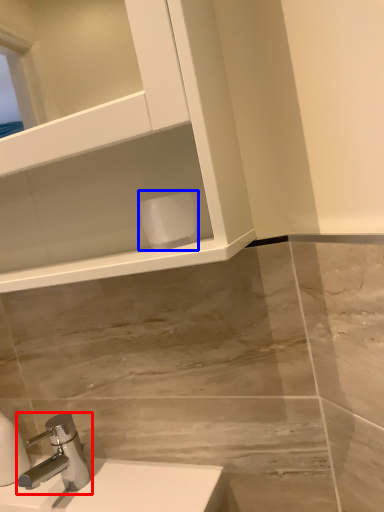
Question: Which object appears farthest to the camera in this image, tap (highlighted by a red box) or toilet paper (highlighted by a blue box)?

Choices:
 (A) tap
 (B) toilet paper

Answer: (A)